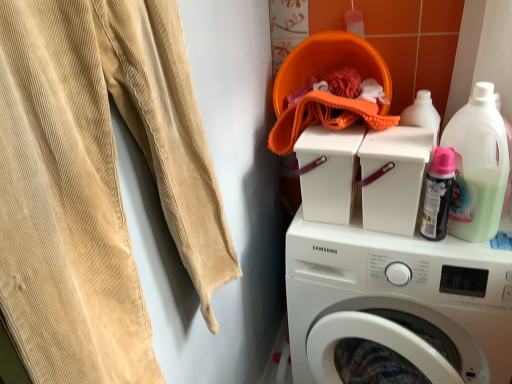
You are a GUI agent. You are given a task and a screenshot of the screen. Output one action in this format:
    pyautogui.click(x=<x>, y=<y>)
    Task: Click on the free space to the left of matte black spray can at upper right
    
    Given the screenshot: What is the action you would take?
    pyautogui.click(x=378, y=240)